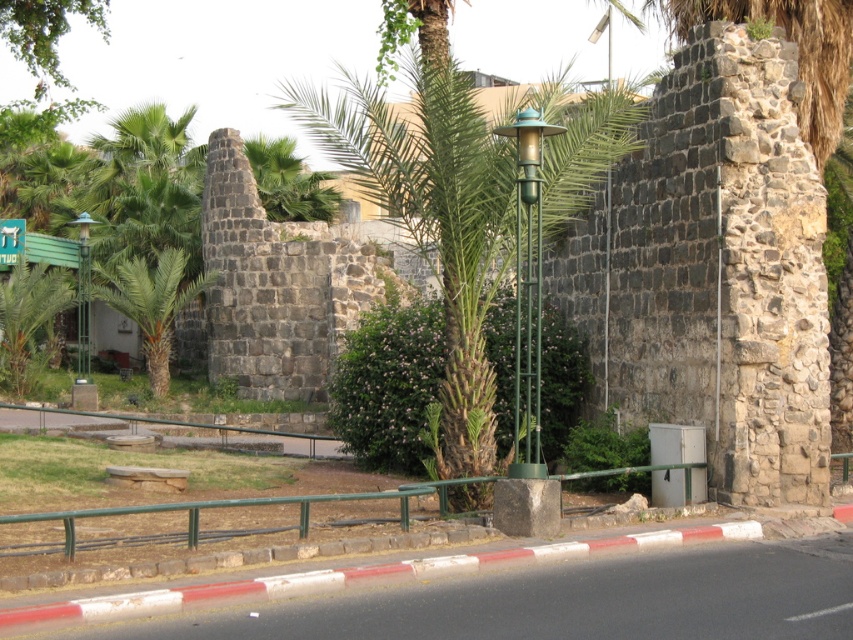
Who is more forward, (556, 212) or (82, 273)?

Point (556, 212) is in front.

At what (x,y) coordinates should I click in order to perform the action: click on green leafy palm tree at center. Please return your answer as a coordinate pair (x, y). This screenshot has height=640, width=853. Looking at the image, I should click on (437, 230).

From the picture: Who is taller, green matte lamp post at center or green leafy palm tree at left?

With more height is green leafy palm tree at left.

Does green matte lamp post at center have a greater width compared to green leafy palm tree at left?

No.

Locate an element on the screen. green matte lamp post at center is located at coordinates (527, 289).

Does green matte lamp post at center have a larger size compared to green metallic lamp post at left?

Correct, green matte lamp post at center is larger in size than green metallic lamp post at left.

What do you see at coordinates (527, 289) in the screenshot? The height and width of the screenshot is (640, 853). I see `green matte lamp post at center` at bounding box center [527, 289].

Does point (520, 208) lie in front of point (86, 300)?

Yes.

Image resolution: width=853 pixels, height=640 pixels. I want to click on green matte lamp post at center, so click(527, 289).